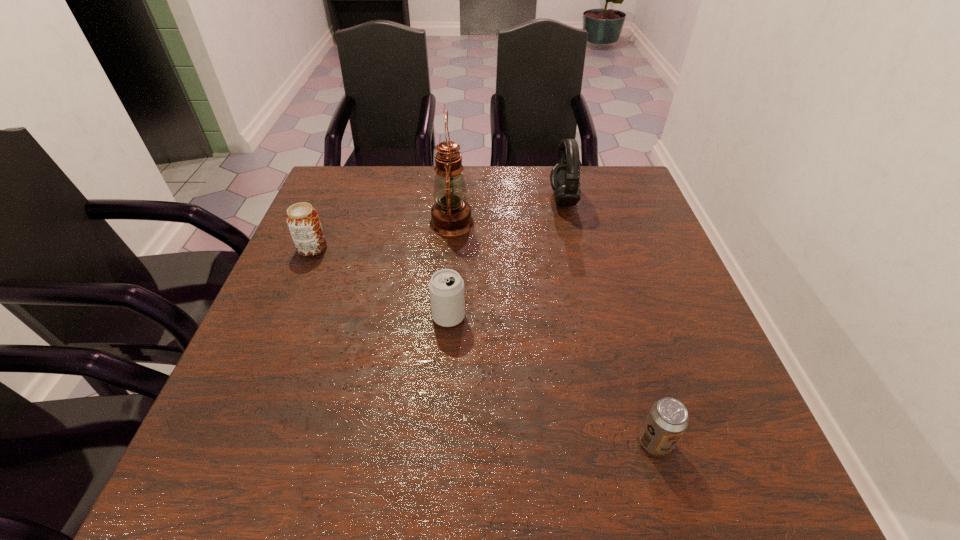
Find the location of a particular element. the tallest object is located at coordinates (451, 215).

Locate an element on the screen. This screenshot has width=960, height=540. headset is located at coordinates click(x=565, y=175).

At what (x,y) coordinates should I click in order to perform the action: click on the leftmost object. Please return your answer as a coordinate pair (x, y). Looking at the image, I should click on (302, 219).

Find the location of a particular element. The height and width of the screenshot is (540, 960). the farther beer can is located at coordinates (302, 219).

Find the location of a particular element. The image size is (960, 540). the second nearest object is located at coordinates (446, 287).

At what (x,y) coordinates should I click in order to perform the action: click on the nearer beer can. Please return your answer as a coordinate pair (x, y). The width and height of the screenshot is (960, 540). Looking at the image, I should click on (667, 419).

Identify the location of the nearest object. (667, 419).

Find the location of `vacant space located 0.070m on the back of the oil lamp`. vacant space located 0.070m on the back of the oil lamp is located at coordinates (454, 193).

What are the coordinates of `free space located 0.100m on the earcups of the fourth shortest object` in the screenshot? It's located at (516, 200).

Find the location of a particular element. This screenshot has width=960, height=540. free location located 0.160m on the earcups of the fourth shortest object is located at coordinates (494, 200).